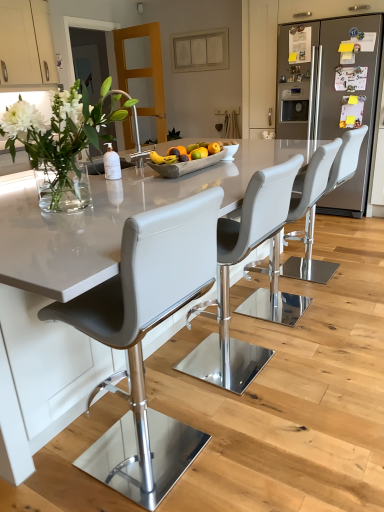
The height and width of the screenshot is (512, 384). Find the location of `free area in between white leather bar stool at center, the second chair in the front-to-back sequence, and matte gray chair at center, acting as the 1th chair starting from the front`. free area in between white leather bar stool at center, the second chair in the front-to-back sequence, and matte gray chair at center, acting as the 1th chair starting from the front is located at coordinates (200, 404).